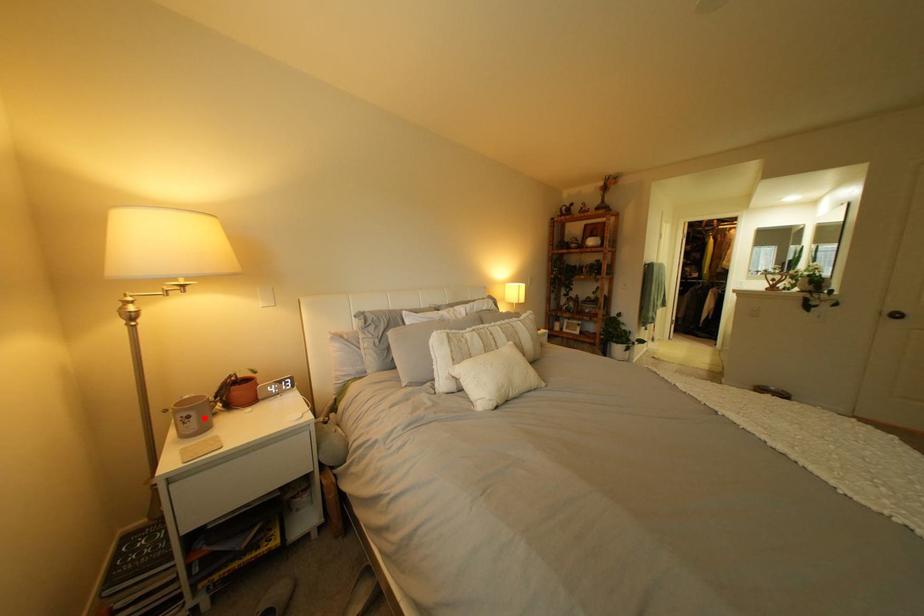
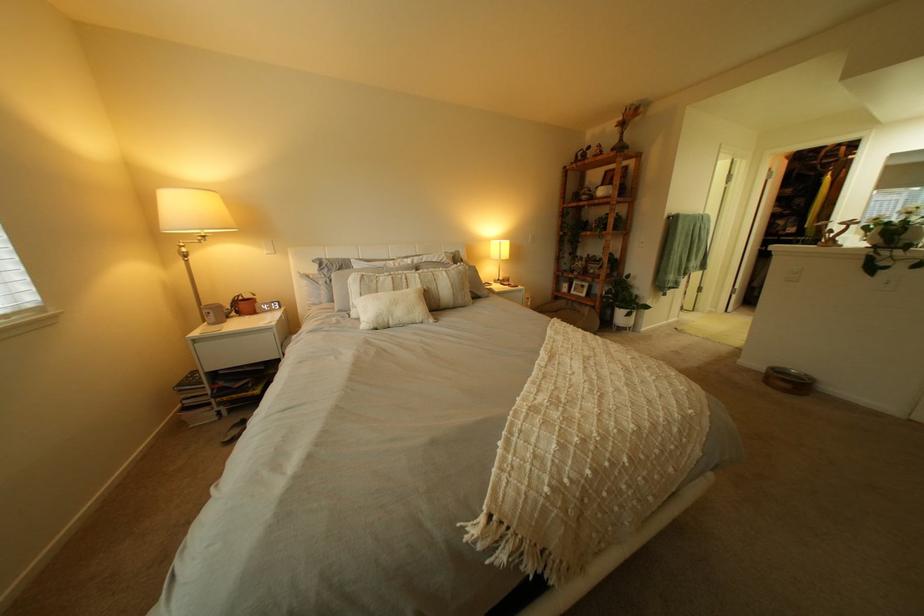
Find the pixel in the second image that matches the highlighted location in the first image.

(225, 314)